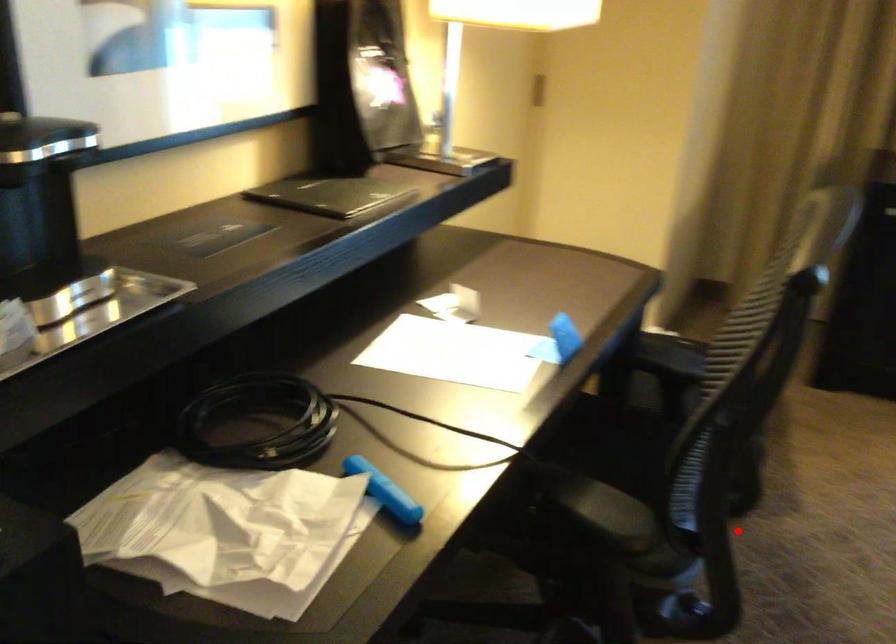
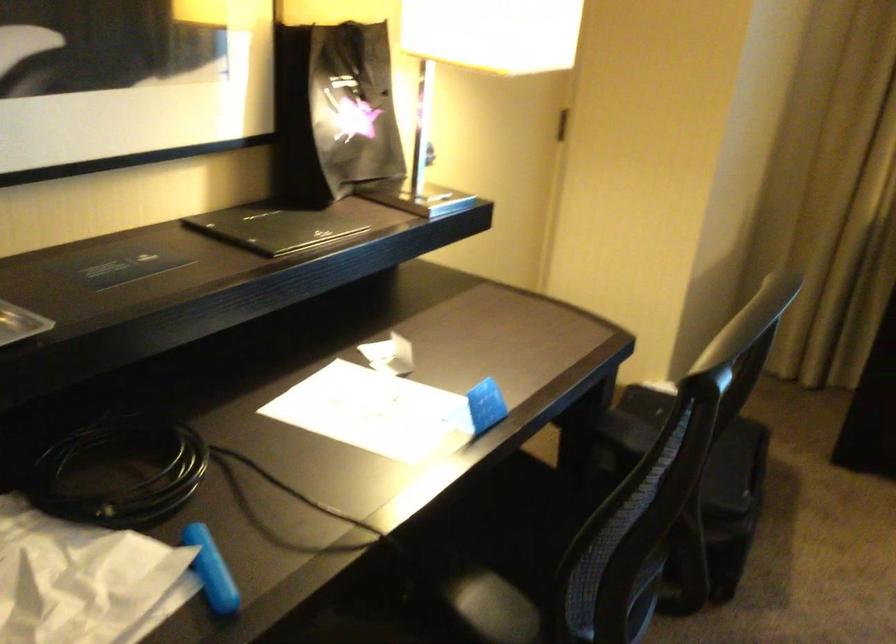
Find the pixel in the second image that matches the highlighted location in the first image.

(709, 618)